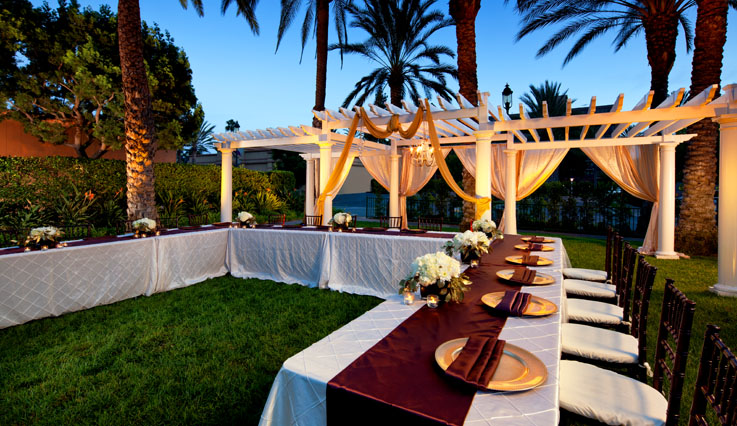
Image resolution: width=737 pixels, height=426 pixels. I want to click on bouquets, so click(433, 265), click(466, 245), click(483, 220), click(342, 217), click(242, 216), click(143, 222), click(45, 232).